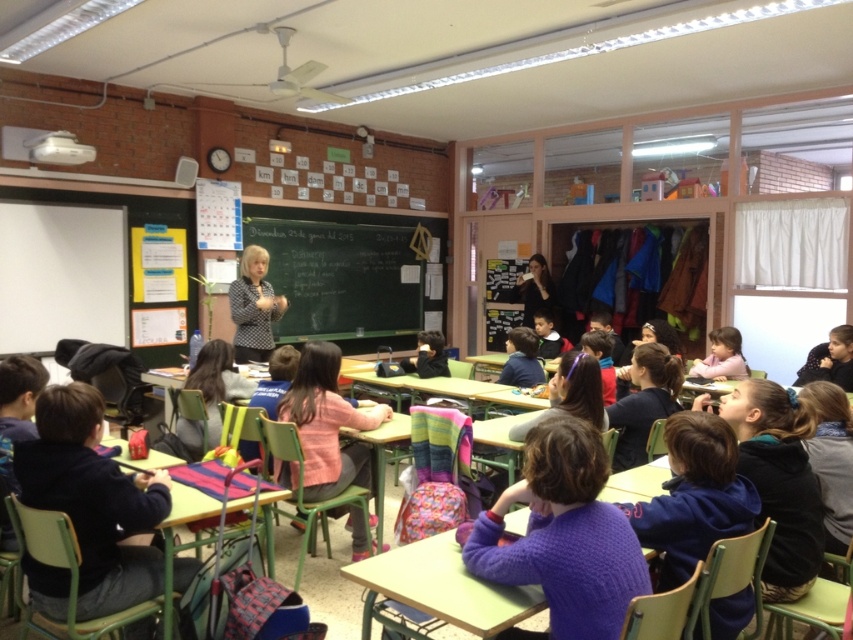
Question: Which object appears farthest from the camera in this image?

Choices:
 (A) matte black shirt at center
 (B) blackboard at center
 (C) purple fleece jacket at lower right

Answer: (A)

Question: Does purple knitted sweater at center have a smaller size compared to blue sweater at center?

Choices:
 (A) yes
 (B) no

Answer: (B)

Question: Which point is farther to the camera?

Choices:
 (A) dark blue sweater at center
 (B) matte black shirt at center

Answer: (B)

Question: Which point is farther to the camera?

Choices:
 (A) polka dot blouse at center
 (B) dark blue sweater at center

Answer: (A)

Question: Does purple knitted sweater at center have a smaller size compared to blue sweater at center?

Choices:
 (A) no
 (B) yes

Answer: (A)

Question: Can you confirm if purple knitted sweater at center is positioned below purple fleece jacket at lower right?

Choices:
 (A) yes
 (B) no

Answer: (B)